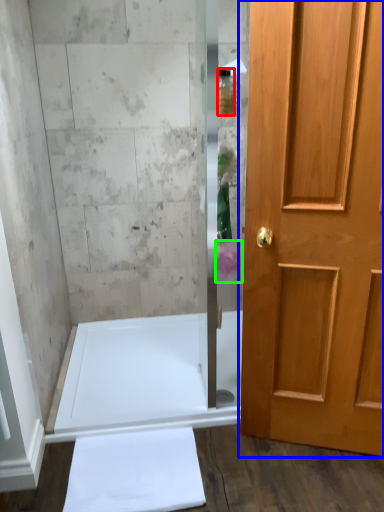
Question: Considering the real-world distances, which object is closest to toiletry (highlighted by a red box)? door (highlighted by a blue box) or flower (highlighted by a green box).

Choices:
 (A) door
 (B) flower

Answer: (B)